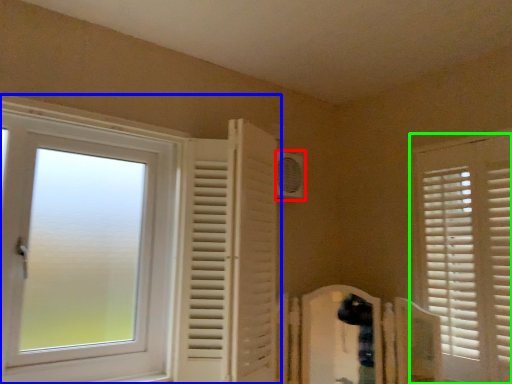
Question: Estimate the real-world distances between objects in this image. Which object is closer to air conditioning (highlighted by a red box), window (highlighted by a blue box) or window (highlighted by a green box)?

Choices:
 (A) window
 (B) window

Answer: (A)